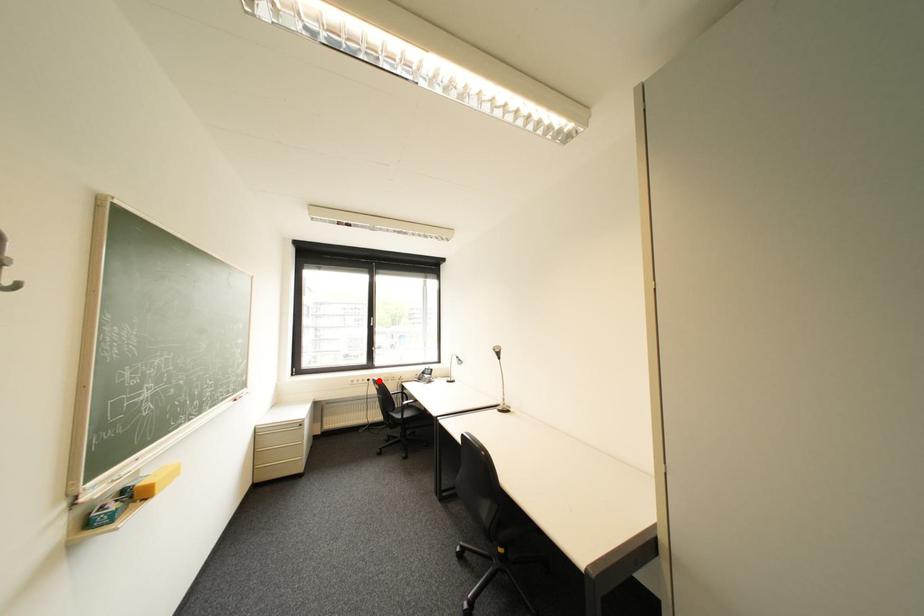
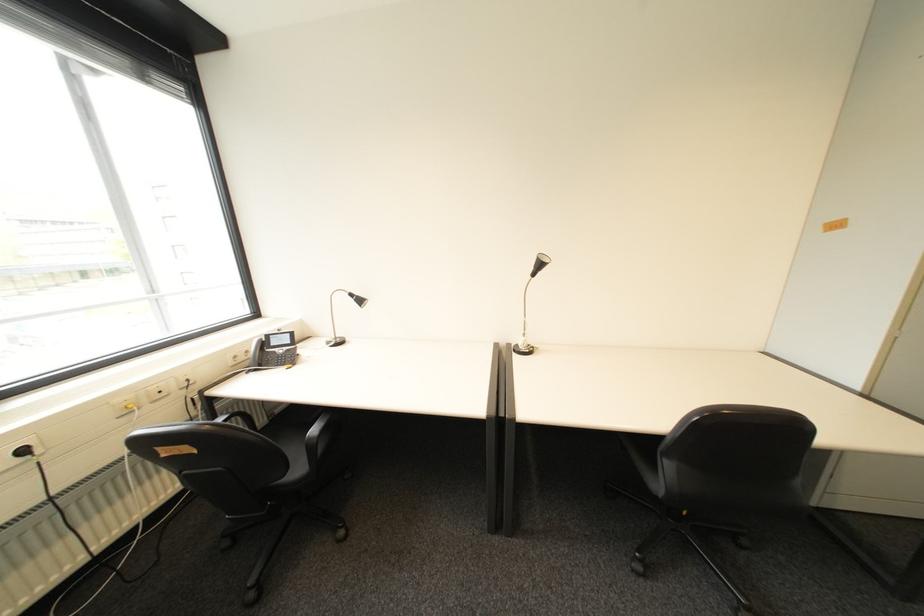
Find the pixel in the second image that matches the highlighted location in the first image.

(34, 452)